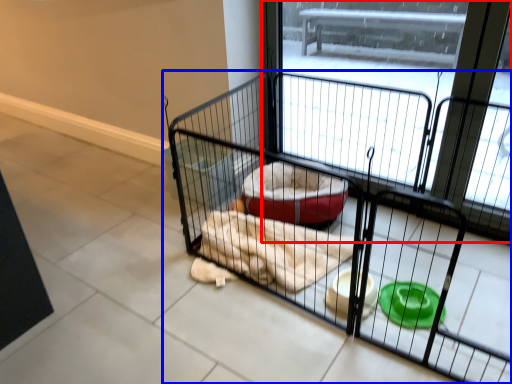
Question: Which of the following is the farthest to the observer, screen door (highlighted by a red box) or cage (highlighted by a blue box)?

Choices:
 (A) screen door
 (B) cage

Answer: (A)